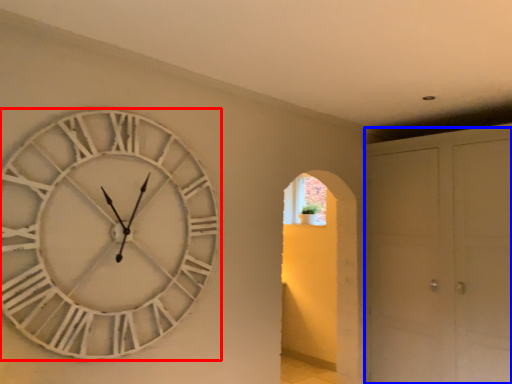
Question: Which of the following is the closest to the observer, wall clock (highlighted by a red box) or glass door (highlighted by a blue box)?

Choices:
 (A) wall clock
 (B) glass door

Answer: (A)